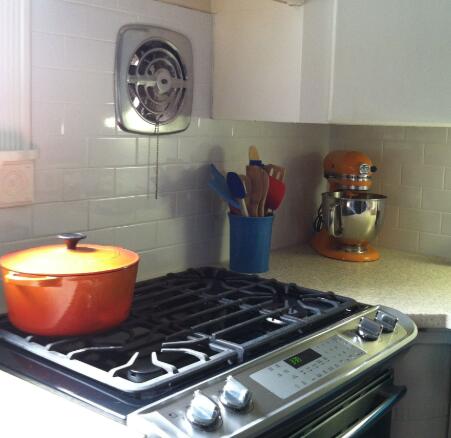
I want to click on cup full of spatulas, so point(251,238).